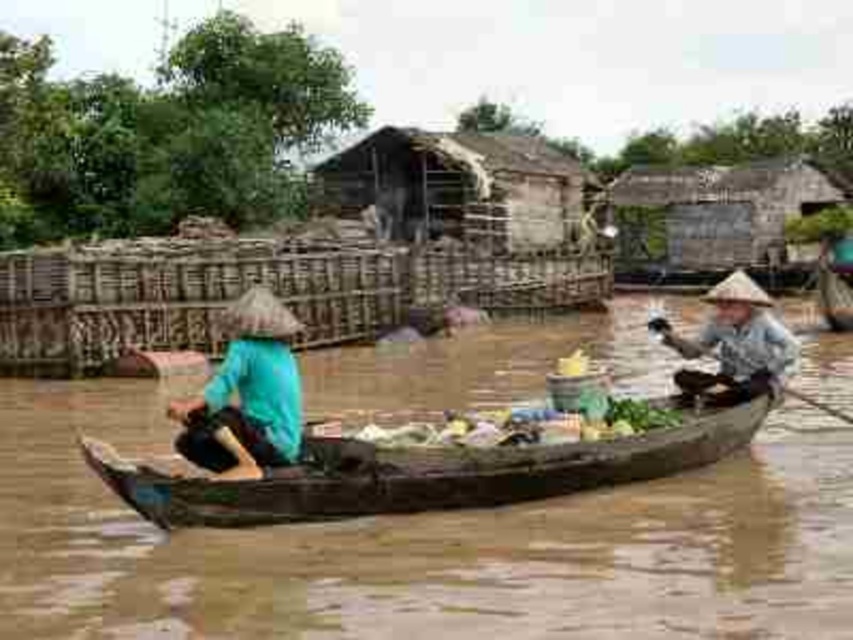
Which is behind, point (181, 432) or point (776, 328)?

The point (776, 328) is more distant.

Is teal fabric hat at left positioned in front of matte brown hat at right?

That is True.

This screenshot has width=853, height=640. Describe the element at coordinates (247, 394) in the screenshot. I see `teal fabric hat at left` at that location.

You are a GUI agent. You are given a task and a screenshot of the screen. Output one action in this format:
    pyautogui.click(x=<x>, y=<y>)
    Task: Click on the teal fabric hat at left
    The width and height of the screenshot is (853, 640).
    Given the screenshot: What is the action you would take?
    pyautogui.click(x=247, y=394)

Is point (309, 621) farther from viewer compared to point (247, 429)?

That is False.

Measure the distance between brown wooden boat at center and camera.

brown wooden boat at center and camera are 10.18 meters apart.

You are a GUI agent. You are given a task and a screenshot of the screen. Output one action in this format:
    pyautogui.click(x=<x>, y=<y>)
    Task: Click on the brown wooden boat at center
    The height and width of the screenshot is (640, 853).
    Given the screenshot: What is the action you would take?
    click(425, 547)

Is point (630, 464) less distant than point (741, 349)?

Yes.

Between wooden canoe at center and matte brown hat at right, which one has more height?

matte brown hat at right is taller.

Identify the location of wooden canoe at center. Image resolution: width=853 pixels, height=640 pixels. (419, 472).

In order to click on wooden canoe at center in this screenshot , I will do `click(419, 472)`.